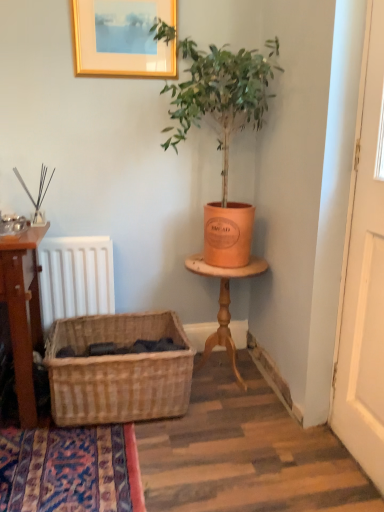
Question: Relative to gold wooden picture frame at upper center, is orange clay pot at upper right in front or behind?

Choices:
 (A) front
 (B) behind

Answer: (A)

Question: From a real-world perspective, is orange clay pot at upper right above or below gold wooden picture frame at upper center?

Choices:
 (A) below
 (B) above

Answer: (A)

Question: Estimate the real-world distances between objects in this image. Which object is closer to the wooden table at right?

Choices:
 (A) gold wooden picture frame at upper center
 (B) white wooden door at right
 (C) orange clay pot at upper right
 (D) woven natural basket at lower left

Answer: (D)

Question: Which is nearer to the woven natural basket at lower left?

Choices:
 (A) orange clay pot at upper right
 (B) white wooden door at right
 (C) gold wooden picture frame at upper center
 (D) wooden table at right

Answer: (D)